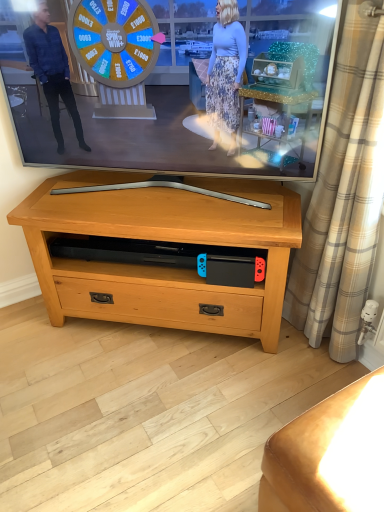
Question: Can you confirm if beige plaid curtain at right is bigger than matte black tv at center?

Choices:
 (A) no
 (B) yes

Answer: (A)

Question: Does beige plaid curtain at right turn towards matte black tv at center?

Choices:
 (A) yes
 (B) no

Answer: (B)

Question: Does beige plaid curtain at right lie behind matte black tv at center?

Choices:
 (A) no
 (B) yes

Answer: (A)

Question: Does beige plaid curtain at right appear on the left side of matte black tv at center?

Choices:
 (A) yes
 (B) no

Answer: (B)

Question: Is beige plaid curtain at right directly adjacent to matte black tv at center?

Choices:
 (A) yes
 (B) no

Answer: (B)

Question: From the image's perspective, is pine wood tv stand at center located above or below matte black tv at center?

Choices:
 (A) below
 (B) above

Answer: (A)

Question: Relative to matte black tv at center, is pine wood tv stand at center in front or behind?

Choices:
 (A) front
 (B) behind

Answer: (B)

Question: Looking at the image, does pine wood tv stand at center seem bigger or smaller compared to matte black tv at center?

Choices:
 (A) big
 (B) small

Answer: (A)

Question: From a real-world perspective, is pine wood tv stand at center physically located above or below matte black tv at center?

Choices:
 (A) below
 (B) above

Answer: (A)

Question: Would you say matte black tv at center is inside or outside leather couch at lower right?

Choices:
 (A) inside
 (B) outside

Answer: (B)

Question: In terms of height, does matte black tv at center look taller or shorter compared to leather couch at lower right?

Choices:
 (A) short
 (B) tall

Answer: (B)

Question: From a real-world perspective, is matte black tv at center physically located above or below leather couch at lower right?

Choices:
 (A) below
 (B) above

Answer: (B)

Question: From the image's perspective, is matte black tv at center above or below leather couch at lower right?

Choices:
 (A) above
 (B) below

Answer: (A)

Question: From their relative heights in the image, would you say beige plaid curtain at right is taller or shorter than leather couch at lower right?

Choices:
 (A) tall
 (B) short

Answer: (A)

Question: Which is correct: beige plaid curtain at right is inside leather couch at lower right, or outside of it?

Choices:
 (A) outside
 (B) inside

Answer: (A)